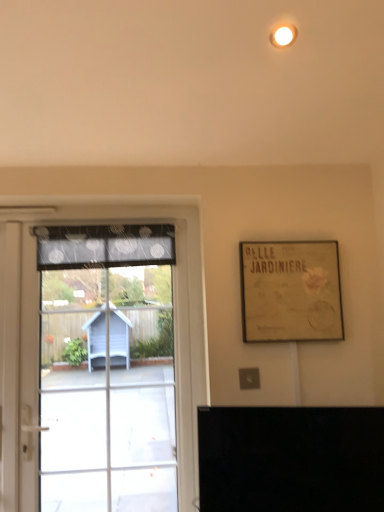
Question: From a real-world perspective, is gold textured paper at upper right over transparent glass door at left?

Choices:
 (A) no
 (B) yes

Answer: (B)

Question: Considering the relative sizes of gold textured paper at upper right and transparent glass door at left in the image provided, is gold textured paper at upper right taller than transparent glass door at left?

Choices:
 (A) no
 (B) yes

Answer: (A)

Question: Considering the relative sizes of gold textured paper at upper right and transparent glass door at left in the image provided, is gold textured paper at upper right thinner than transparent glass door at left?

Choices:
 (A) yes
 (B) no

Answer: (A)

Question: Considering the relative sizes of gold textured paper at upper right and transparent glass door at left in the image provided, is gold textured paper at upper right bigger than transparent glass door at left?

Choices:
 (A) yes
 (B) no

Answer: (B)

Question: Is gold textured paper at upper right looking in the opposite direction of transparent glass door at left?

Choices:
 (A) no
 (B) yes

Answer: (A)

Question: From a real-world perspective, is gold textured paper at upper right physically below transparent glass door at left?

Choices:
 (A) no
 (B) yes

Answer: (A)

Question: Is transparent glass door at left surrounding black glossy tv at lower center?

Choices:
 (A) yes
 (B) no

Answer: (B)

Question: From the image's perspective, would you say transparent glass door at left is shown under black glossy tv at lower center?

Choices:
 (A) yes
 (B) no

Answer: (B)

Question: Is transparent glass door at left further to camera compared to black glossy tv at lower center?

Choices:
 (A) yes
 (B) no

Answer: (A)

Question: Is transparent glass door at left at the right side of black glossy tv at lower center?

Choices:
 (A) yes
 (B) no

Answer: (B)

Question: Are transparent glass door at left and black glossy tv at lower center far apart?

Choices:
 (A) yes
 (B) no

Answer: (B)

Question: Does transparent glass door at left have a larger size compared to black glossy tv at lower center?

Choices:
 (A) yes
 (B) no

Answer: (A)

Question: Can you confirm if gold textured paper at upper right is taller than black glossy tv at lower center?

Choices:
 (A) no
 (B) yes

Answer: (B)